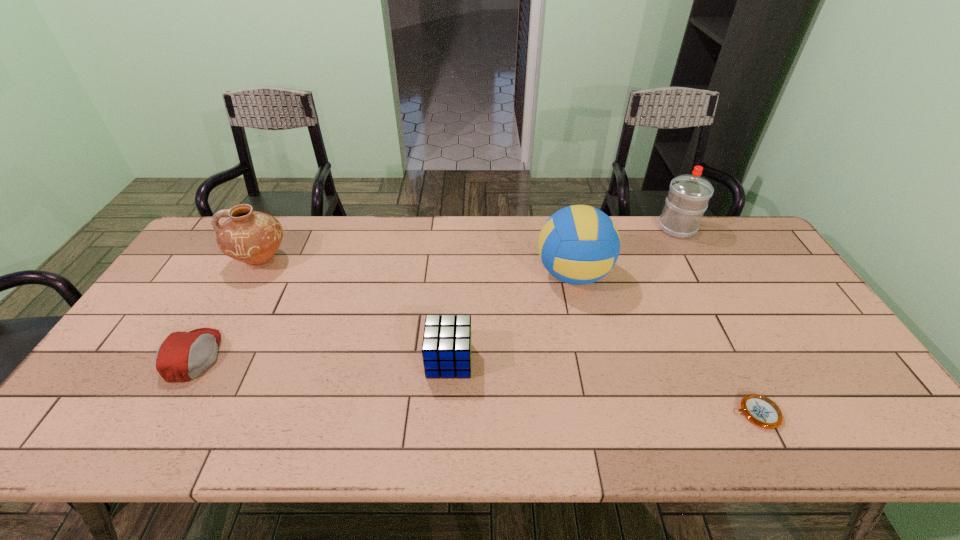
Where is `vacant area situated on the side of the pottery with the handle`? vacant area situated on the side of the pottery with the handle is located at coordinates (213, 261).

Where is `vacant space located on the left of the cube`? The image size is (960, 540). vacant space located on the left of the cube is located at coordinates (318, 360).

Find the location of a particular element. This screenshot has height=540, width=960. vacant space located on the front-facing side of the cap is located at coordinates 345,356.

The width and height of the screenshot is (960, 540). What are the coordinates of `free space located 0.290m on the back of the shortest object` in the screenshot? It's located at (703, 307).

Locate an element on the screen. The width and height of the screenshot is (960, 540). water bottle present at the far edge is located at coordinates (689, 194).

The image size is (960, 540). In order to click on volleyball present at the far edge in this screenshot , I will do `click(579, 244)`.

Image resolution: width=960 pixels, height=540 pixels. What are the coordinates of `pottery at the far edge` in the screenshot? It's located at (252, 237).

The width and height of the screenshot is (960, 540). Identify the location of object present at the near edge. (760, 410).

What are the coordinates of `pottery that is at the left edge` in the screenshot? It's located at point(252,237).

Locate an element on the screen. cap that is at the left edge is located at coordinates (182, 356).